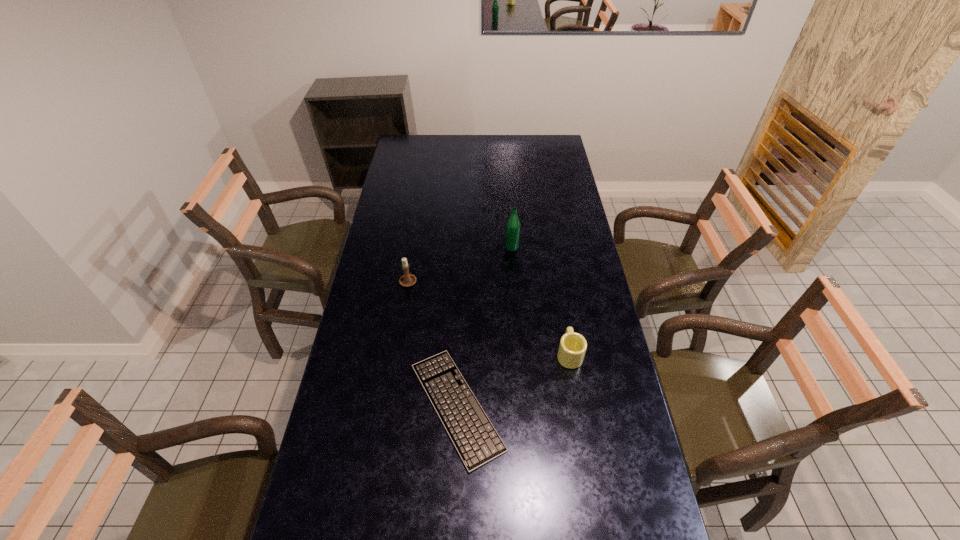
The width and height of the screenshot is (960, 540). Identify the location of the farthest object. (512, 228).

You are a GUI agent. You are given a task and a screenshot of the screen. Output one action in this format:
    pyautogui.click(x=<x>, y=<y>)
    Task: Click on the tallest object
    
    Given the screenshot: What is the action you would take?
    pyautogui.click(x=512, y=228)

Find the location of a particular element. This screenshot has height=540, width=960. the third shortest object is located at coordinates (406, 280).

Locate an element on the screen. Image resolution: width=960 pixels, height=540 pixels. the leftmost object is located at coordinates (406, 280).

You are a GUI agent. You are given a task and a screenshot of the screen. Output one action in this format:
    pyautogui.click(x=<x>, y=<y>)
    Task: Click on the mug
    
    Given the screenshot: What is the action you would take?
    pyautogui.click(x=572, y=348)

This screenshot has height=540, width=960. What are the coordinates of `the third tallest object` in the screenshot? It's located at (572, 348).

At what (x,y) coordinates should I click in order to perform the action: click on the third object from right to left. Please return your answer as a coordinate pair (x, y). This screenshot has width=960, height=540. Looking at the image, I should click on (473, 435).

Locate an element on the screen. The image size is (960, 540). the shortest object is located at coordinates (473, 435).

The height and width of the screenshot is (540, 960). In order to click on vacant point located on the back of the tallest object in this screenshot , I will do 511,230.

Where is `free location located 0.120m on the side of the second tallest object with the handle`? free location located 0.120m on the side of the second tallest object with the handle is located at coordinates (413, 252).